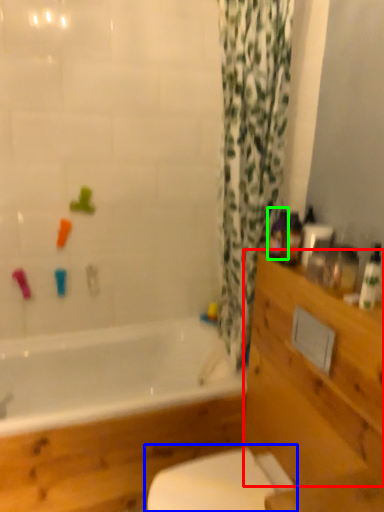
Question: Which object is positioned closest to drawer (highlighted by a red box)? Select from toilet (highlighted by a blue box) and toiletry (highlighted by a green box).

Choices:
 (A) toilet
 (B) toiletry

Answer: (A)